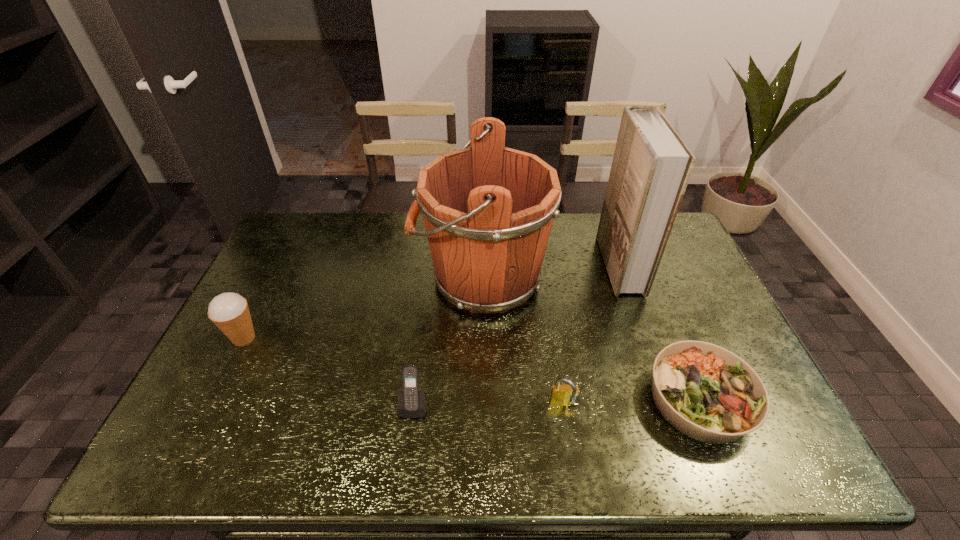
Locate an element on the screen. This screenshot has height=540, width=960. vacant space that satisfies the following two spatial constraints: 1. on the cover of the phonebook; 2. on the front side of the third tallest object is located at coordinates (645, 338).

Locate an element on the screen. vacant space that satisfies the following two spatial constraints: 1. with the handle on the side of the bucket; 2. on the front side of the leftmost object is located at coordinates (482, 338).